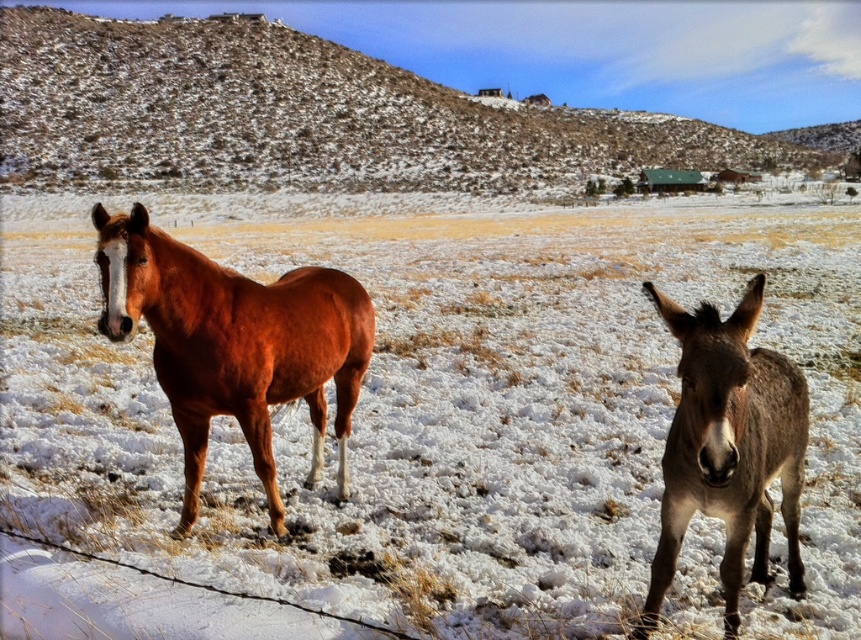
You are standing in the snowy field and want to walk from the point at coordinates point (364, 296) to the point at coordinates point (733, 365). Which direction should you move relative to your current position?

You should move away from yourself because point (733, 365) is further away than point (364, 296).